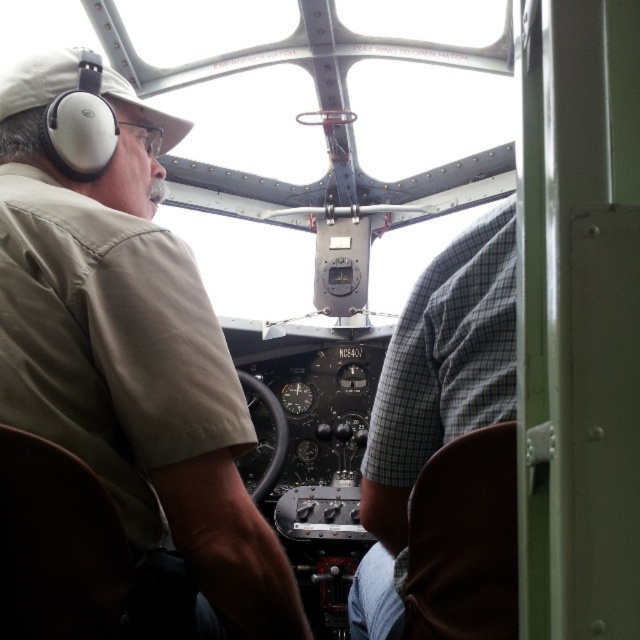
Question: Is matte khaki shirt at left bigger than gray checkered shirt at center?

Choices:
 (A) no
 (B) yes

Answer: (B)

Question: Which of the following is the closest to the observer?

Choices:
 (A) gray checkered shirt at center
 (B) matte khaki shirt at left

Answer: (B)

Question: Does matte khaki shirt at left have a smaller size compared to gray checkered shirt at center?

Choices:
 (A) no
 (B) yes

Answer: (A)

Question: Considering the relative positions of matte khaki shirt at left and gray checkered shirt at center in the image provided, where is matte khaki shirt at left located with respect to gray checkered shirt at center?

Choices:
 (A) right
 (B) left

Answer: (B)

Question: Which object is farther from the camera taking this photo?

Choices:
 (A) matte khaki shirt at left
 (B) gray checkered shirt at center

Answer: (B)